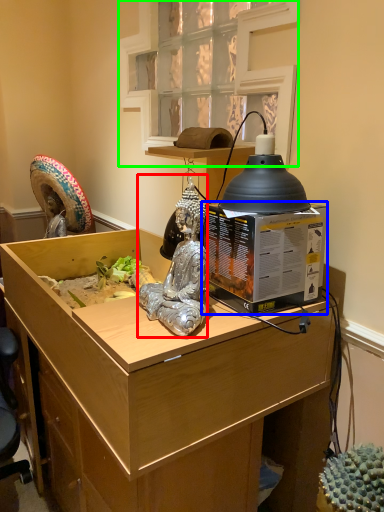
Question: Based on their relative distances, which object is nearer to person (highlighted by a red box)? Choose from box (highlighted by a blue box) and window (highlighted by a green box).

Choices:
 (A) box
 (B) window

Answer: (A)